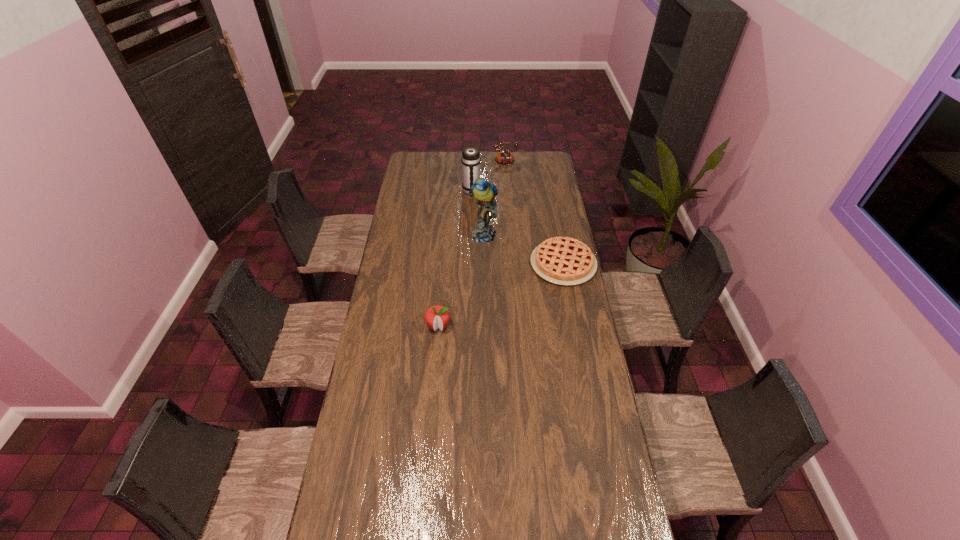
You are a GUI agent. You are given a task and a screenshot of the screen. Output one action in this format:
    pyautogui.click(x=<x>, y=<y>)
    Task: Click on the free space located on the side with the handle of the thermos bottle
    
    Given the screenshot: What is the action you would take?
    pyautogui.click(x=478, y=211)

Image resolution: width=960 pixels, height=540 pixels. Find the location of `free point located on the side with the handle of the thermos bottle`. free point located on the side with the handle of the thermos bottle is located at coordinates (489, 237).

Identify the location of vacant space positioned 0.090m on the side with the handle of the thermos bottle. Image resolution: width=960 pixels, height=540 pixels. (477, 207).

Where is `free space located 0.330m on the face of the parrot`? free space located 0.330m on the face of the parrot is located at coordinates (491, 296).

The image size is (960, 540). In order to click on free space located on the face of the parrot in this screenshot , I will do `click(491, 294)`.

This screenshot has width=960, height=540. I want to click on free space located on the face of the parrot, so click(491, 296).

The width and height of the screenshot is (960, 540). I want to click on free location located 0.080m on the rotary dial of the telephone, so click(x=497, y=177).

Find the location of a particular element. vacant space located 0.270m on the rotary dial of the telephone is located at coordinates (501, 195).

At what (x,y) coordinates should I click in order to perform the action: click on vacant point located on the rotary dial of the telephone. Please return your answer as a coordinate pair (x, y). The width and height of the screenshot is (960, 540). Looking at the image, I should click on (502, 199).

Identify the location of object positioned at the far edge. (504, 157).